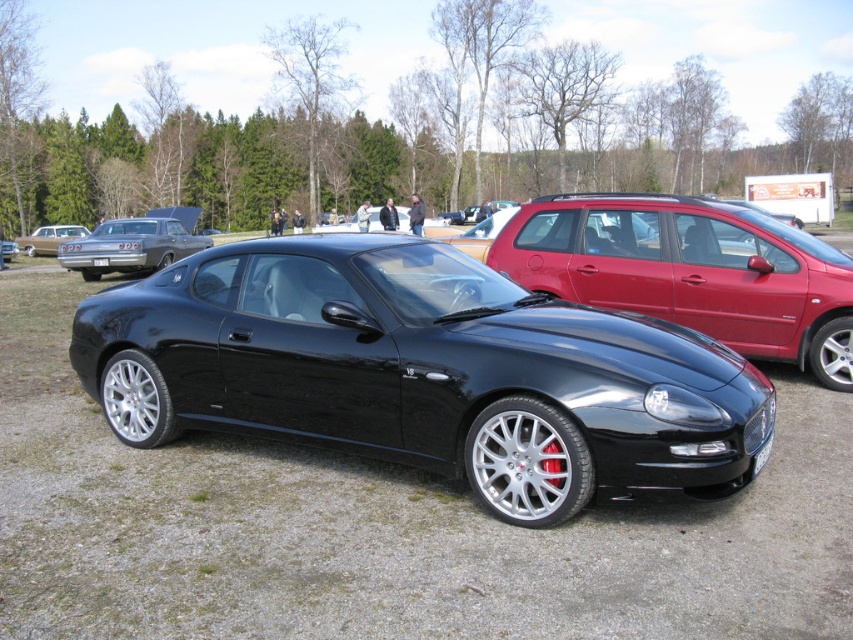
Question: Based on their relative distances, which object is farther from the white plastic license plate at front?

Choices:
 (A) matte silver sedan at upper left
 (B) matte silver classic car at left
 (C) white plastic license plate at center

Answer: (B)

Question: Which is nearer to the black metallic sports car at center?

Choices:
 (A) white plastic license plate at center
 (B) white plastic license plate at front

Answer: (B)

Question: Does black metallic sports car at center lie in front of matte silver sedan at upper left?

Choices:
 (A) no
 (B) yes

Answer: (B)

Question: Is matte silver sedan at upper left behind white plastic license plate at center?

Choices:
 (A) yes
 (B) no

Answer: (A)

Question: Which point is closer to the camera?

Choices:
 (A) (22, 237)
 (B) (352, 332)
 (C) (97, 257)

Answer: (B)

Question: Can you confirm if matte silver sedan at upper left is bigger than white plastic license plate at center?

Choices:
 (A) yes
 (B) no

Answer: (A)